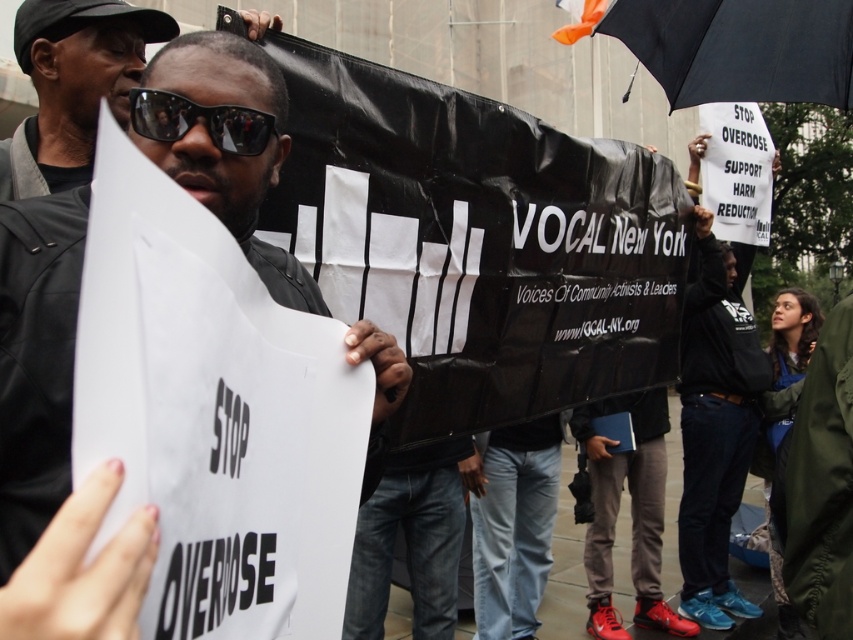
Question: Where is black leather jacket at center located in relation to matte black sunglasses at center in the image?

Choices:
 (A) left
 (B) right

Answer: (B)

Question: Which object is farther from the camera taking this photo?

Choices:
 (A) sunglasses at center
 (B) matte black sunglasses at center

Answer: (B)

Question: Among these objects, which one is farthest from the camera?

Choices:
 (A) black matte umbrella at upper right
 (B) sunglasses at center
 (C) black leather jacket at center

Answer: (A)

Question: Where is black leather jacket at center located in relation to sunglasses at center in the image?

Choices:
 (A) below
 (B) above

Answer: (A)

Question: Estimate the real-world distances between objects in this image. Which object is farther from the black leather jacket at center?

Choices:
 (A) matte black sunglasses at center
 (B) sunglasses at center
 (C) black matte umbrella at upper right

Answer: (C)

Question: Is black leather jacket at center wider than sunglasses at center?

Choices:
 (A) no
 (B) yes

Answer: (B)